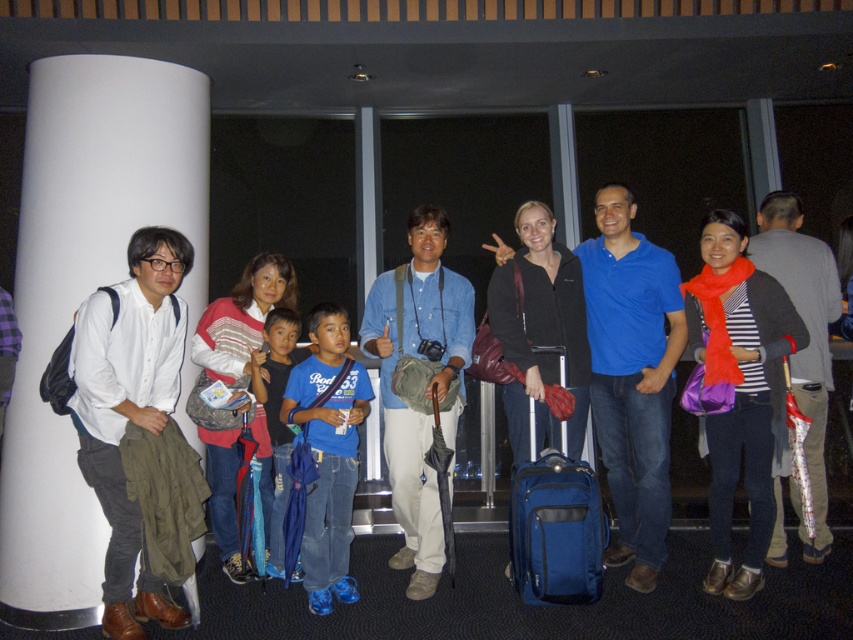
You are a traveler who just arrived at the airport and see the image. You need to quickly locate your belongings. Which item is positioned lower between the matte blue suitcase at center and the blue denim jeans at center?

The matte blue suitcase at center is located below the blue denim jeans at center, so the matte blue suitcase at center is positioned lower.

You are a photographer trying to focus on two points in the image. The first point is at coordinates point (204, 611) and the second is at point (341, 536). Which point is closer to your camera lens?

Point (204, 611) is closer to the camera lens than point (341, 536).

You are standing at the center of the image and want to place your new matte blue suitcase at center. Where should you put it?

You should place your new matte blue suitcase at center at point [535,605].